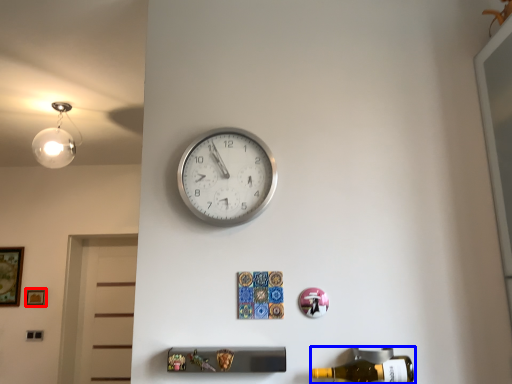
Question: Among these objects, which one is farthest to the camera, picture frame (highlighted by a red box) or beer bottle (highlighted by a blue box)?

Choices:
 (A) picture frame
 (B) beer bottle

Answer: (A)